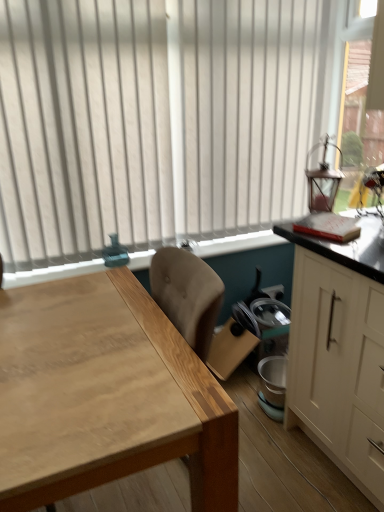
This screenshot has height=512, width=384. I want to click on vacant region above natural wood table at center (from a real-world perspective), so click(83, 347).